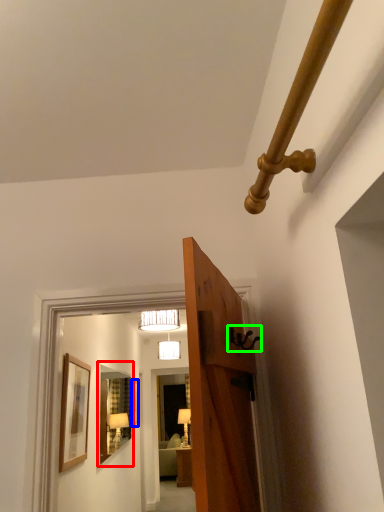
Question: Which is farther away from mirror (highlighted by a red box)? picture frame (highlighted by a blue box) or door handle (highlighted by a green box)?

Choices:
 (A) picture frame
 (B) door handle

Answer: (B)